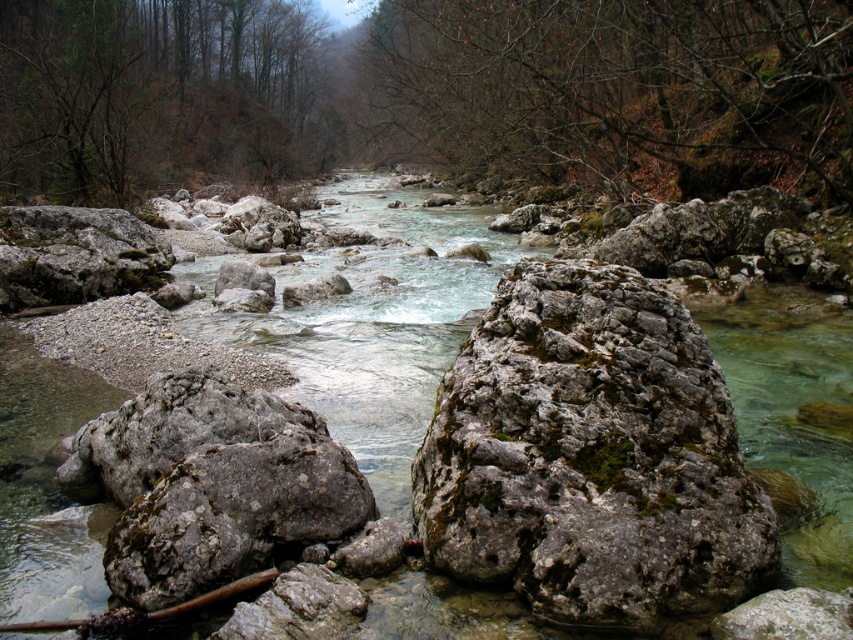
You are planning to cross the river using the rocks. The green mossy rocks at center and the gray rough rock at center are your stepping stones. Which rock should you step on first to ensure stability?

You should step on the green mossy rocks at center first because they are wider than the gray rough rock at center, providing a more stable footing.

You are a hiker trying to cross the river at the center. You see the green mossy rocks at center and the clear water stream at center. Which object is higher in elevation?

The green mossy rocks at center are taller than the clear water stream at center, so the green mossy rocks at center are higher in elevation.